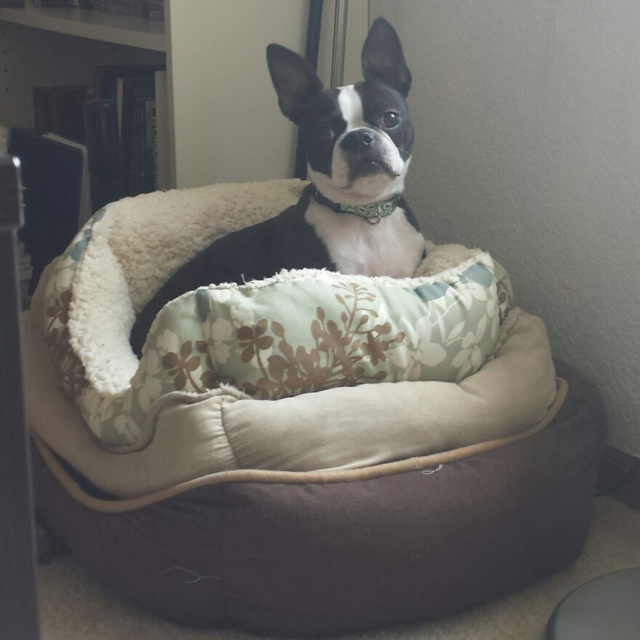
Is fluffy beige dog bed at center above wooden bookshelf at upper left?

Incorrect, fluffy beige dog bed at center is not positioned above wooden bookshelf at upper left.

Is point (179, 483) behind point (218, 134)?

No, (179, 483) is closer to viewer.

Is point (406, 428) positioned before point (225, 172)?

Yes, it is in front of point (225, 172).

The height and width of the screenshot is (640, 640). I want to click on fluffy beige dog bed at center, so click(x=292, y=454).

Which is in front, point (291, 157) or point (355, 160)?

Point (355, 160)

Is wooden bookshelf at upper left above black and white fur at center?

Yes, wooden bookshelf at upper left is above black and white fur at center.

Between point (116, 45) and point (342, 125), which one is positioned in front?

Point (342, 125) is in front.

The image size is (640, 640). What are the coordinates of `wooden bookshelf at upper left` in the screenshot? It's located at (172, 76).

Which is in front, point (92, 481) or point (301, 125)?

Point (92, 481) is in front.

Measure the distance between point (80, 292) and camera.

Point (80, 292) is 5.39 feet from camera.

Locate an element on the screen. The width and height of the screenshot is (640, 640). fluffy beige dog bed at center is located at coordinates (292, 454).